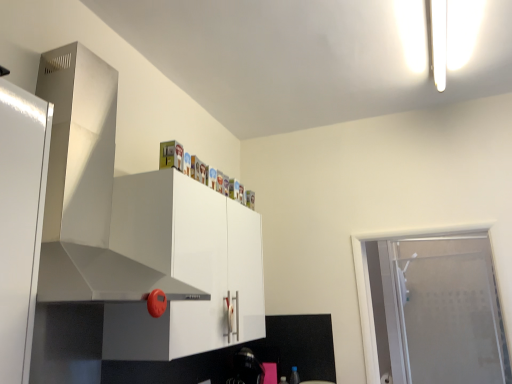
Question: Is frosted glass door at right thinner than stainless steel exhaust hood at upper left?

Choices:
 (A) yes
 (B) no

Answer: (A)

Question: From the image's perspective, is frosted glass door at right on stainless steel exhaust hood at upper left?

Choices:
 (A) yes
 (B) no

Answer: (B)

Question: Can you confirm if frosted glass door at right is bigger than stainless steel exhaust hood at upper left?

Choices:
 (A) yes
 (B) no

Answer: (B)

Question: From a real-world perspective, is frosted glass door at right under stainless steel exhaust hood at upper left?

Choices:
 (A) no
 (B) yes

Answer: (B)

Question: Does frosted glass door at right lie behind stainless steel exhaust hood at upper left?

Choices:
 (A) yes
 (B) no

Answer: (A)

Question: Considering the relative positions of stainless steel exhaust hood at upper left and frosted glass door at right in the image provided, is stainless steel exhaust hood at upper left to the left or to the right of frosted glass door at right?

Choices:
 (A) left
 (B) right

Answer: (A)

Question: From a real-world perspective, relative to frosted glass door at right, is stainless steel exhaust hood at upper left vertically above or below?

Choices:
 (A) above
 (B) below

Answer: (A)

Question: Choose the correct answer: Is stainless steel exhaust hood at upper left inside frosted glass door at right or outside it?

Choices:
 (A) outside
 (B) inside

Answer: (A)

Question: From their relative heights in the image, would you say stainless steel exhaust hood at upper left is taller or shorter than frosted glass door at right?

Choices:
 (A) tall
 (B) short

Answer: (A)

Question: From the image's perspective, is frosted glass door at right positioned above or below stainless steel exhaust hood at upper left?

Choices:
 (A) below
 (B) above

Answer: (A)

Question: In the image, is frosted glass door at right on the left side or the right side of stainless steel exhaust hood at upper left?

Choices:
 (A) left
 (B) right

Answer: (B)

Question: Considering the positions of frosted glass door at right and stainless steel exhaust hood at upper left in the image, is frosted glass door at right wider or thinner than stainless steel exhaust hood at upper left?

Choices:
 (A) wide
 (B) thin

Answer: (B)

Question: Which is correct: frosted glass door at right is inside stainless steel exhaust hood at upper left, or outside of it?

Choices:
 (A) inside
 (B) outside

Answer: (B)

Question: From a real-world perspective, is frosted glass door at right positioned above or below white glossy cabinet at upper center?

Choices:
 (A) below
 (B) above

Answer: (A)

Question: Considering the relative positions of frosted glass door at right and white glossy cabinet at upper center in the image provided, is frosted glass door at right to the left or to the right of white glossy cabinet at upper center?

Choices:
 (A) right
 (B) left

Answer: (A)